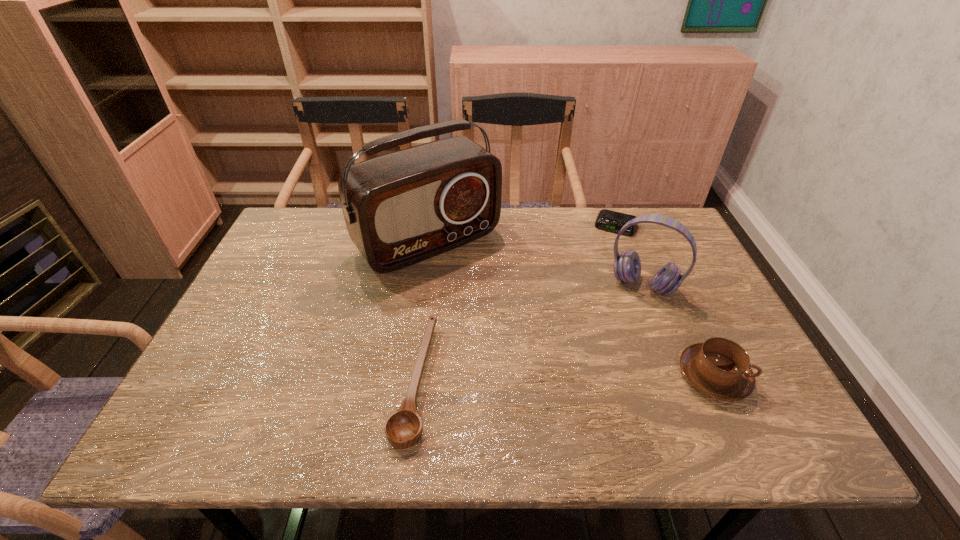
Identify the location of vacant space on the desktop that is between the wooden spoon and the cappuccino and is positioned on the display of the alarm clock. (561, 379).

The width and height of the screenshot is (960, 540). What are the coordinates of `free spot on the desktop that is between the wooden spoon and the cappuccino and is positioned on the front panel of the tallest object` in the screenshot? It's located at (554, 380).

You are a GUI agent. You are given a task and a screenshot of the screen. Output one action in this format:
    pyautogui.click(x=<x>, y=<y>)
    Task: Click on the free space on the desktop that is between the wooden spoon and the third tallest object and is positioned on the headband and ear cups of the headset
    Image resolution: width=960 pixels, height=540 pixels.
    Given the screenshot: What is the action you would take?
    pyautogui.click(x=603, y=379)